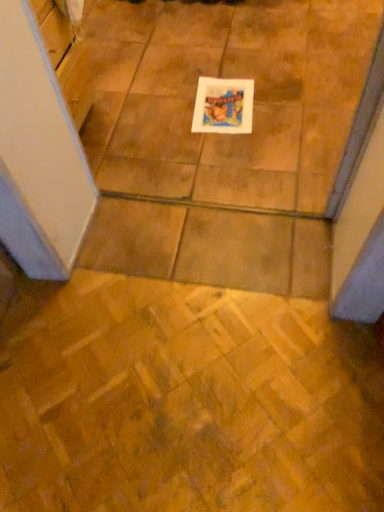
You are a GUI agent. You are given a task and a screenshot of the screen. Output one action in this format:
    pyautogui.click(x=<x>, y=<y>)
    Task: Click on the spots to the right of white paper at center
    
    Given the screenshot: What is the action you would take?
    pyautogui.click(x=288, y=102)